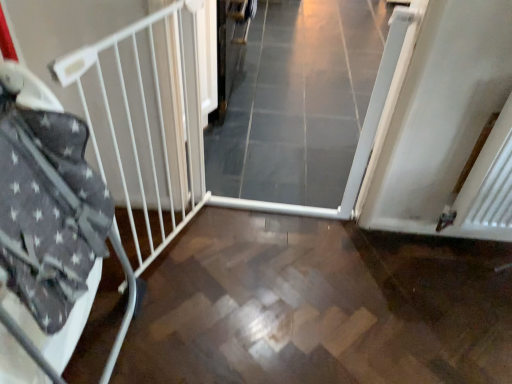
Question: Is white glossy door at center thinner than white metal bed frame at left?

Choices:
 (A) yes
 (B) no

Answer: (B)

Question: From the image's perspective, would you say white glossy door at center is positioned over white metal bed frame at left?

Choices:
 (A) yes
 (B) no

Answer: (A)

Question: Considering the relative positions of white glossy door at center and white metal bed frame at left in the image provided, is white glossy door at center to the right of white metal bed frame at left from the viewer's perspective?

Choices:
 (A) no
 (B) yes

Answer: (B)

Question: From a real-world perspective, is white glossy door at center on top of white metal bed frame at left?

Choices:
 (A) no
 (B) yes

Answer: (A)

Question: Could white metal bed frame at left be considered to be inside white glossy door at center?

Choices:
 (A) no
 (B) yes

Answer: (A)

Question: Considering the positions of wooden floor at center and white glossy door at center in the image, is wooden floor at center bigger or smaller than white glossy door at center?

Choices:
 (A) small
 (B) big

Answer: (A)

Question: In terms of height, does wooden floor at center look taller or shorter compared to white glossy door at center?

Choices:
 (A) short
 (B) tall

Answer: (A)

Question: Does point (202, 311) appear closer or farther from the camera than point (305, 134)?

Choices:
 (A) closer
 (B) farther

Answer: (A)

Question: Would you say wooden floor at center is inside or outside white glossy door at center?

Choices:
 (A) inside
 (B) outside

Answer: (B)

Question: From a real-world perspective, is white metal bed frame at left above or below white glossy door at center?

Choices:
 (A) below
 (B) above

Answer: (B)

Question: Is white metal bed frame at left spatially inside white glossy door at center, or outside of it?

Choices:
 (A) outside
 (B) inside

Answer: (A)

Question: From the image's perspective, is white metal bed frame at left above or below white glossy door at center?

Choices:
 (A) below
 (B) above

Answer: (A)

Question: In the image, is white metal bed frame at left on the left side or the right side of white glossy door at center?

Choices:
 (A) right
 (B) left

Answer: (B)

Question: Does point (203, 326) appear closer or farther from the camera than point (31, 322)?

Choices:
 (A) closer
 (B) farther

Answer: (B)

Question: Considering the positions of wooden floor at center and white metal bed frame at left in the image, is wooden floor at center taller or shorter than white metal bed frame at left?

Choices:
 (A) tall
 (B) short

Answer: (B)